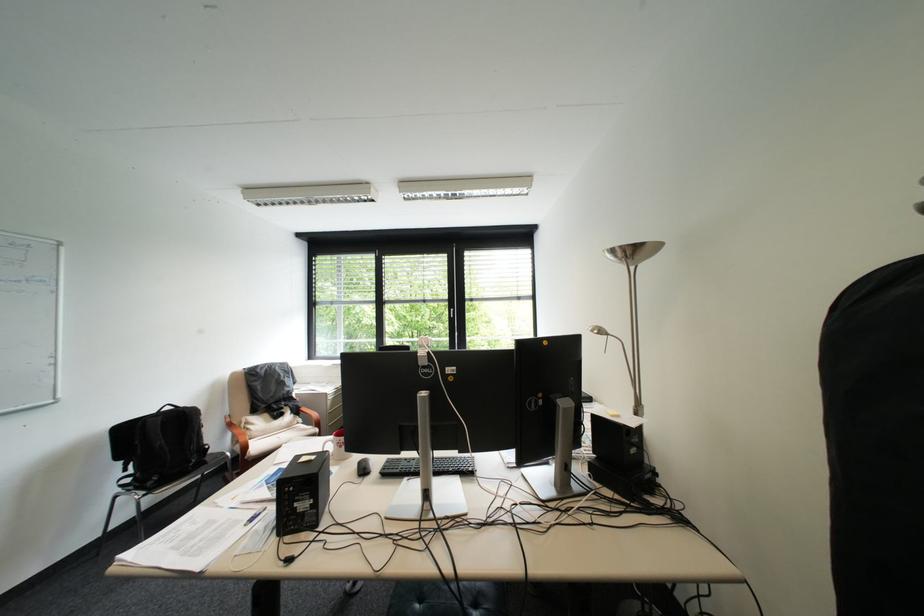
The height and width of the screenshot is (616, 924). Find the location of `floor lamp head`. floor lamp head is located at coordinates (633, 253).